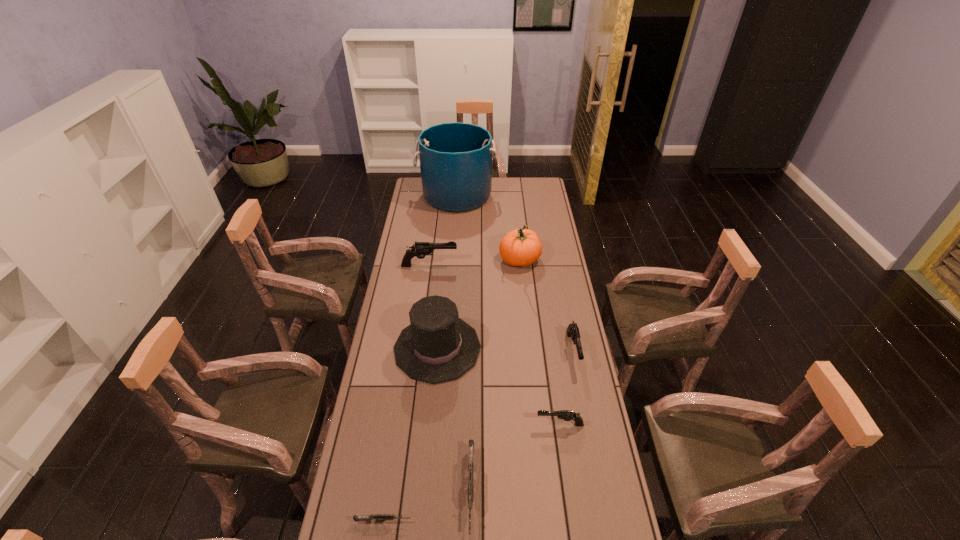
Where is `blue bucket`? This screenshot has width=960, height=540. blue bucket is located at coordinates (455, 158).

The height and width of the screenshot is (540, 960). What are the coordinates of `bucket` in the screenshot? It's located at (455, 158).

Where is `orange pumpkin`? orange pumpkin is located at coordinates tap(520, 247).

Find the location of a particular element. This screenshot has width=960, height=540. pumpkin is located at coordinates (520, 247).

Where is `the third tallest object`? The height and width of the screenshot is (540, 960). the third tallest object is located at coordinates (438, 346).

Where is `purple dress hat`? purple dress hat is located at coordinates (438, 346).

Find the location of `the tallest gun`. the tallest gun is located at coordinates (420, 249).

Where is `the biggest black gun`? This screenshot has height=540, width=960. the biggest black gun is located at coordinates (420, 249).

Locate an element on the screen. The image size is (960, 540). the fourth shortest gun is located at coordinates (572, 331).

Identify the location of the second smallest black gun. The image size is (960, 540). (572, 331).